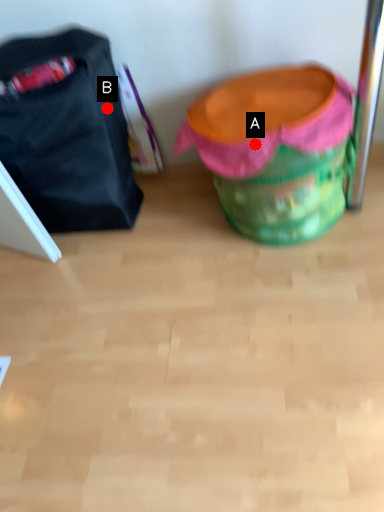
Question: Two points are circled on the image, labeled by A and B beside each circle. Which point is further to the camera?

Choices:
 (A) A is further
 (B) B is further

Answer: (B)